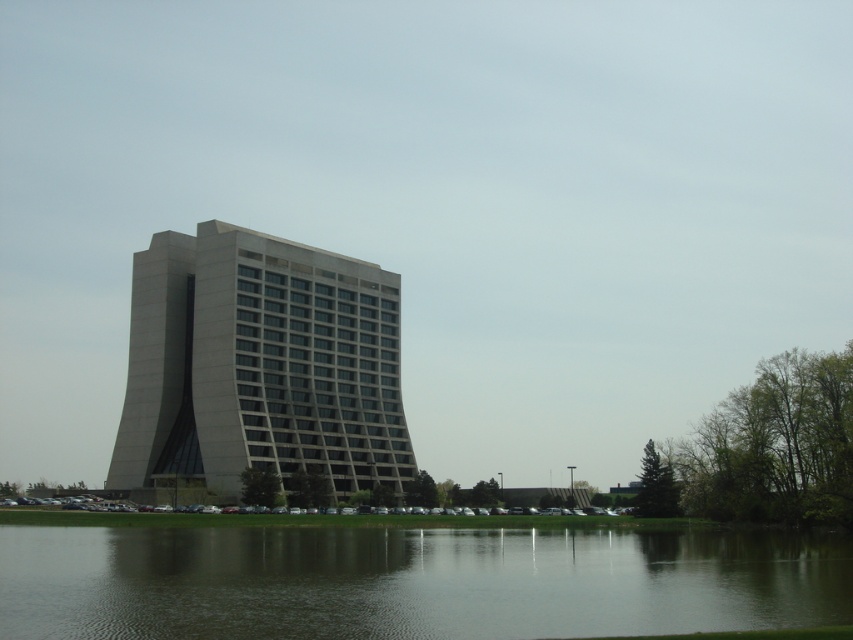
Consider the image. Between dark green water at lower center and gray concrete building at center, which one is positioned higher?

gray concrete building at center

Is dark green water at lower center to the right of gray concrete building at center from the viewer's perspective?

Indeed, dark green water at lower center is positioned on the right side of gray concrete building at center.

Measure the distance between dark green water at lower center and camera.

dark green water at lower center and camera are 19.82 meters apart from each other.

The height and width of the screenshot is (640, 853). What are the coordinates of `dark green water at lower center` in the screenshot? It's located at (412, 580).